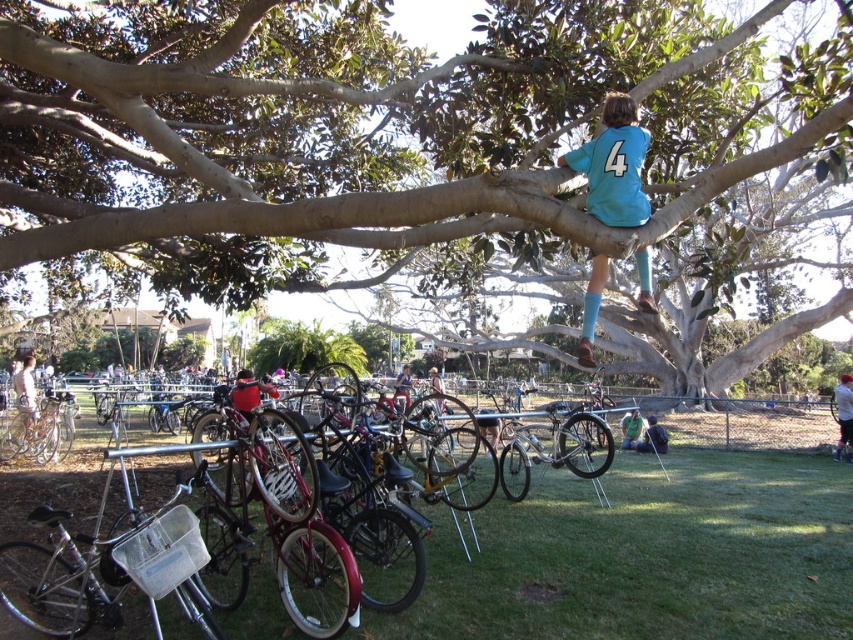
Between brown rough tree at upper center and metallic silver bicycle at center, which one appears on the right side from the viewer's perspective?

brown rough tree at upper center

Who is higher up, brown rough tree at upper center or metallic silver bicycle at center?

Positioned higher is brown rough tree at upper center.

Between point (380, 163) and point (587, 461), which one is positioned in front?

Point (380, 163) is more forward.

Locate an element on the screen. brown rough tree at upper center is located at coordinates (413, 147).

Is metallic silver bicycle at center to the left of teal jersey at upper right from the viewer's perspective?

Indeed, metallic silver bicycle at center is positioned on the left side of teal jersey at upper right.

Is metallic silver bicycle at center closer to camera compared to teal jersey at upper right?

Yes, metallic silver bicycle at center is in front of teal jersey at upper right.

Who is more forward, (73, 621) or (610, 113)?

Positioned in front is point (73, 621).

Locate an element on the screen. The height and width of the screenshot is (640, 853). metallic silver bicycle at center is located at coordinates (53, 586).

Is brown rough tree at upper center above teal jersey at upper right?

Correct, brown rough tree at upper center is located above teal jersey at upper right.

Is brown rough tree at upper center to the left of teal jersey at upper right from the viewer's perspective?

Incorrect, brown rough tree at upper center is not on the left side of teal jersey at upper right.

Locate an element on the screen. brown rough tree at upper center is located at coordinates (413, 147).

Where is `brown rough tree at upper center`? brown rough tree at upper center is located at coordinates (413, 147).